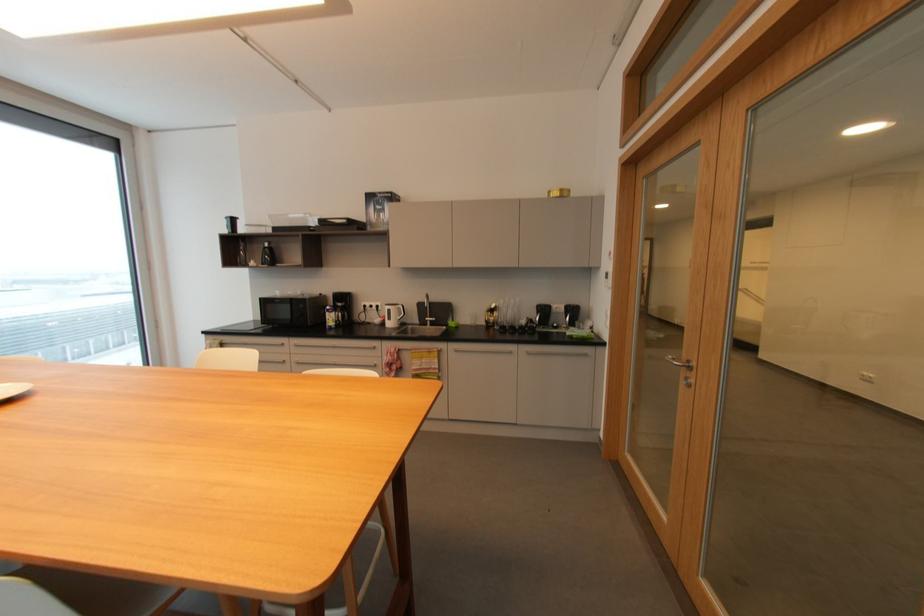
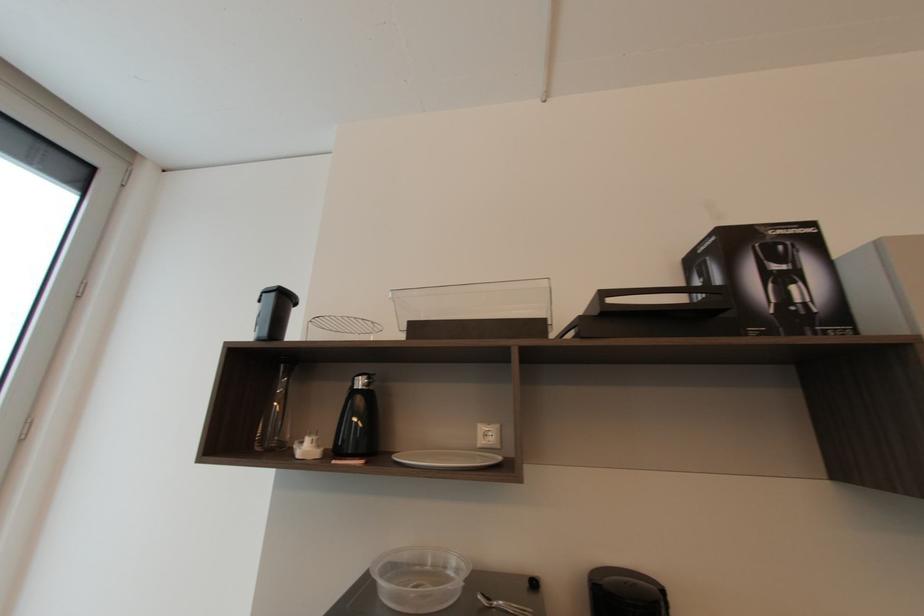
Find the pixel in the second image that matches pixel 256 262 in the first image.

(310, 447)